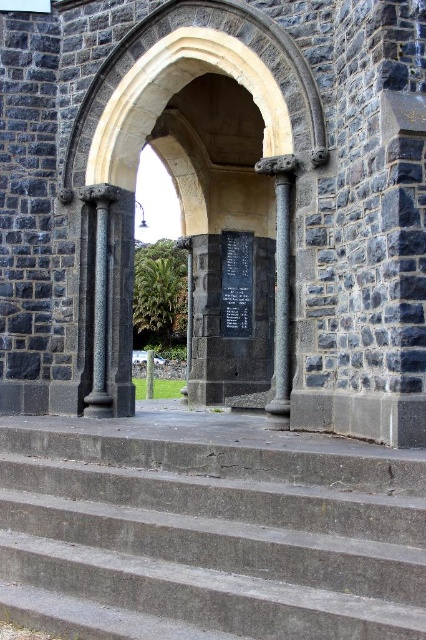
Question: Which point is farther to the camera?

Choices:
 (A) gray stone column at center
 (B) dark gray stone arch at center

Answer: (A)

Question: Is gray concrete stairs at center closer to the viewer compared to dark gray stone arch at center?

Choices:
 (A) no
 (B) yes

Answer: (B)

Question: Considering the relative positions of gray concrete stairs at center and gray stone column at center in the image provided, where is gray concrete stairs at center located with respect to gray stone column at center?

Choices:
 (A) right
 (B) left

Answer: (B)

Question: Which point appears farthest from the camera in this image?

Choices:
 (A) tap(173, 516)
 (B) tap(275, 289)

Answer: (B)

Question: Is gray stone column at center positioned before black polished stone plaque at center?

Choices:
 (A) yes
 (B) no

Answer: (A)

Question: Which object is positioned farthest from the dark gray stone arch at center?

Choices:
 (A) black polished stone plaque at center
 (B) gray stone column at center
 (C) gray concrete stairs at center

Answer: (C)